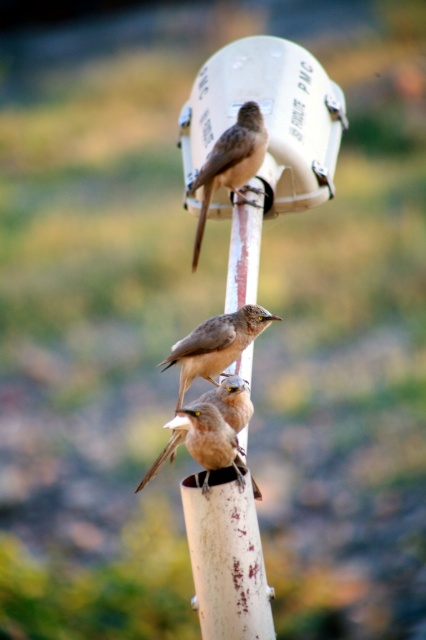
You are a birdwatcher trying to identify the birds on the utility pole. You notice two birds of interest. The first is a brown feathered bird at center and the second is a brown matte bird at lower center. Which of these two birds is bigger in size?

The brown feathered bird at center is larger in size compared to the brown matte bird at lower center.

You are a bird looking for a place to land. You see a white matte bird feeder at upper center and a brown matte bird at upper center. Which object is positioned to the right side?

The white matte bird feeder at upper center is positioned to the right of the brown matte bird at upper center.

You are a birdwatcher trying to identify the positions of two birds on a utility pole. You observe a brown matte bird at upper center and a brown feathered bird at center. Which bird is situated higher up on the pole?

The brown matte bird at upper center is situated higher up on the pole than the brown feathered bird at center.